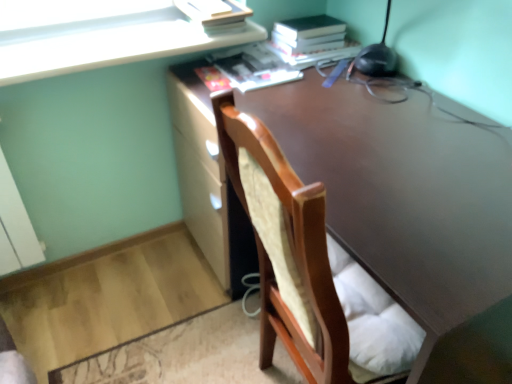
Question: In terms of width, does matte yellow paperback book at upper center, which is the first paperback book from left to right, look wider or thinner when compared to hardcover book at upper right, marked as the second paperback book in a left-to-right arrangement?

Choices:
 (A) wide
 (B) thin

Answer: (B)

Question: Is point (203, 3) positioned closer to the camera than point (287, 43)?

Choices:
 (A) farther
 (B) closer

Answer: (B)

Question: Which is farther from the white glossy cabinet at upper left?

Choices:
 (A) hardcover book at upper right, which is the first paperback book in right-to-left order
 (B) wooden chair at center
 (C) matte yellow paperback book at upper center, which ranks as the 2th paperback book in right-to-left order
 (D) matte paper book at upper center

Answer: (B)

Question: Which object is positioned farthest from the matte yellow paperback book at upper center, which is the first paperback book from left to right?

Choices:
 (A) white glossy cabinet at upper left
 (B) hardcover book at upper right, marked as the second paperback book in a left-to-right arrangement
 (C) wooden chair at center
 (D) matte paper book at upper center

Answer: (C)